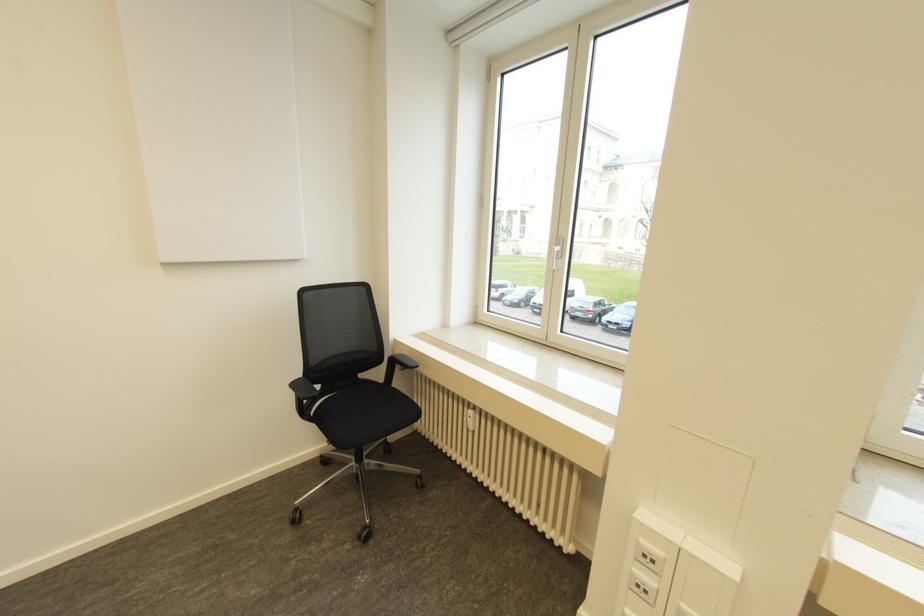
Where would you turn the radiator thermostat? Please return your answer as a coordinate pair (x, y).

(470, 418)